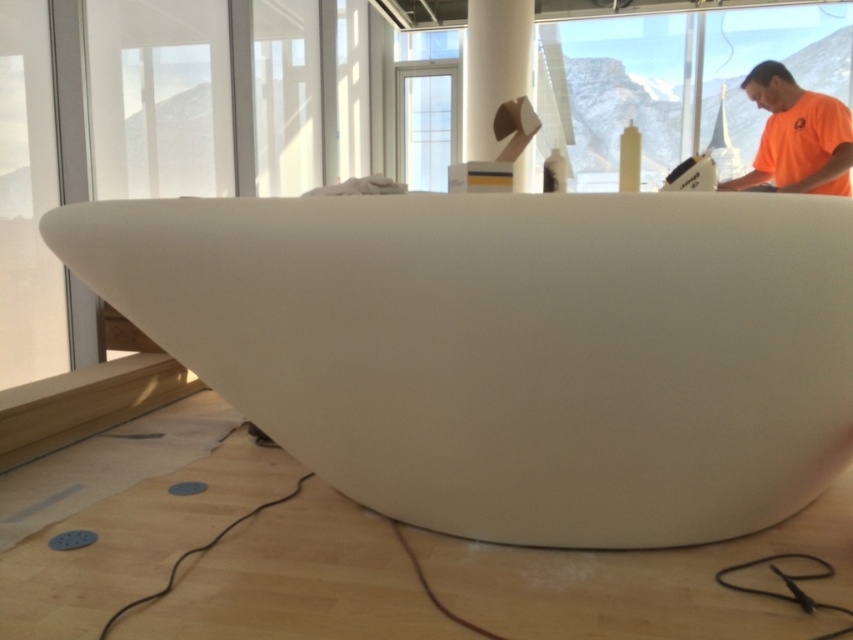
Between matte white pillar at upper center and clear glass window at center, which one has more height?

Standing taller between the two is matte white pillar at upper center.

Is matte white pillar at upper center taller than clear glass window at center?

Yes, matte white pillar at upper center is taller than clear glass window at center.

Does point (518, 61) lie behind point (401, 88)?

That is False.

The image size is (853, 640). What are the coordinates of `matte white pillar at upper center` in the screenshot? It's located at (494, 67).

Does white matte bathtub at center appear under matte white pillar at upper center?

Correct, white matte bathtub at center is located below matte white pillar at upper center.

Between white matte bathtub at center and matte white pillar at upper center, which one is positioned higher?

matte white pillar at upper center is above.

Between point (474, 474) and point (483, 72), which one is positioned behind?

The point (483, 72) is more distant.

Image resolution: width=853 pixels, height=640 pixels. What are the coordinates of `white matte bathtub at center` in the screenshot? It's located at (509, 348).

Between orange t-shirt at upper right and matte white pillar at upper center, which one is positioned lower?

orange t-shirt at upper right

Which is above, orange t-shirt at upper right or matte white pillar at upper center?

matte white pillar at upper center is higher up.

This screenshot has width=853, height=640. What are the coordinates of `orange t-shirt at upper right` in the screenshot? It's located at (796, 136).

I want to click on orange t-shirt at upper right, so click(x=796, y=136).